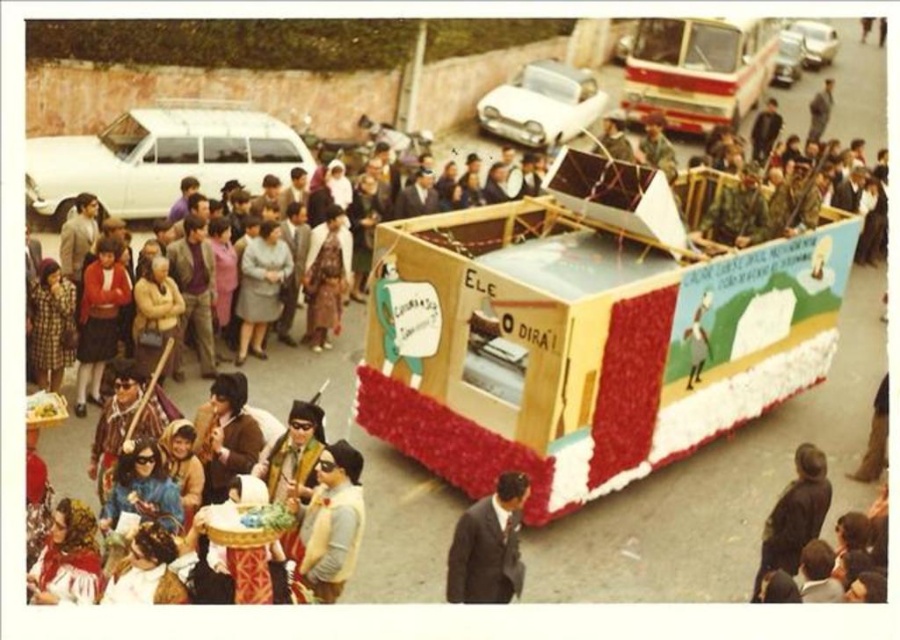
You are a photographer standing at the camera position. You want to take a photo of the metallic silver bus at upper center. If your camera has a maximum focus range of 25 meters, will you be able to focus on the bus?

The metallic silver bus at upper center is 26.11 meters away from the camera. Since the camera can only focus up to 25 meters, you won cannot focus on the bus.

You are standing in the middle of the street at the parade. There is a wooden float at center. Where is the point with coordinates point (585, 337) located?

The point with coordinates point (585, 337) is located on the wooden float at center.

You are standing at the center of the street and want to locate the wooden float at center. What are its coordinates?

The wooden float at center is located at coordinates point [585,337].